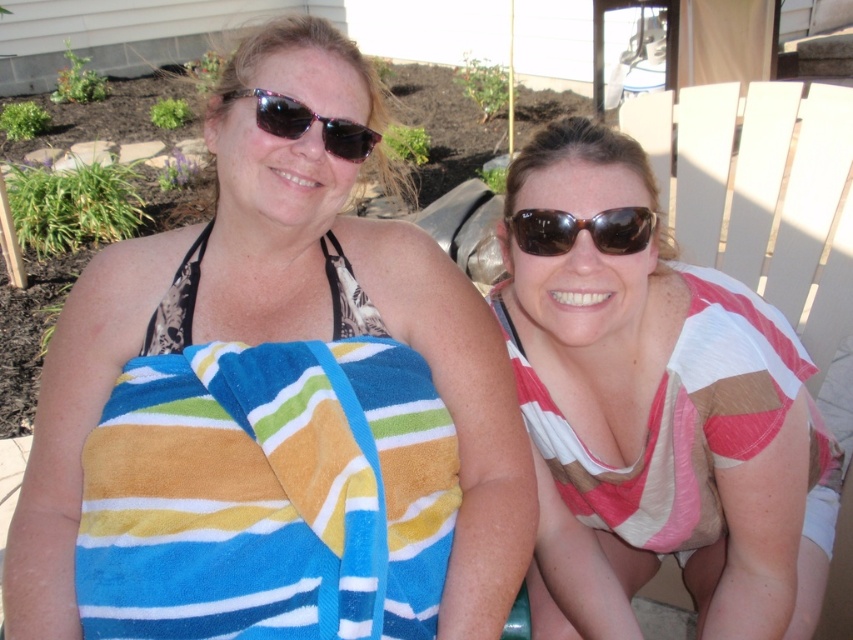
You are standing at the origin point of the coordinate system placed at the bottom left corner of the image. The striped towel at left is located at point (281, 332). If you want to reach the striped towel at left, in which direction should you move from your current position?

The striped towel at left is located at point (281, 332). Since the coordinate system has its origin at the bottom left corner, moving towards the right and upwards from the origin would lead you to the striped towel at left.

From the picture: You are a photographer setting up for a photoshoot. You need to ensure that the distance between the striped fabric shirt at right and the striped cotton beach towel at left is exactly 40 centimeters. Based on the scene, is the current distance sufficient? If not, which item should be moved closer to achieve the desired distance?

The striped fabric shirt at right is 42.76 centimeters away from the striped cotton beach towel at left. To achieve the desired 40 centimeter distance, you should move either the striped fabric shirt at right or the striped cotton beach towel at left closer by approximately 2.76 centimeters.

From the picture: You are a photographer setting up a shoot in this scene. You want to ensure that both the striped fabric shirt at right and the striped cotton beach towel at left are visible in the frame. Based on their positions, which object is closer to the camera?

The striped fabric shirt at right is closer to the camera because the striped cotton beach towel at left is behind it.